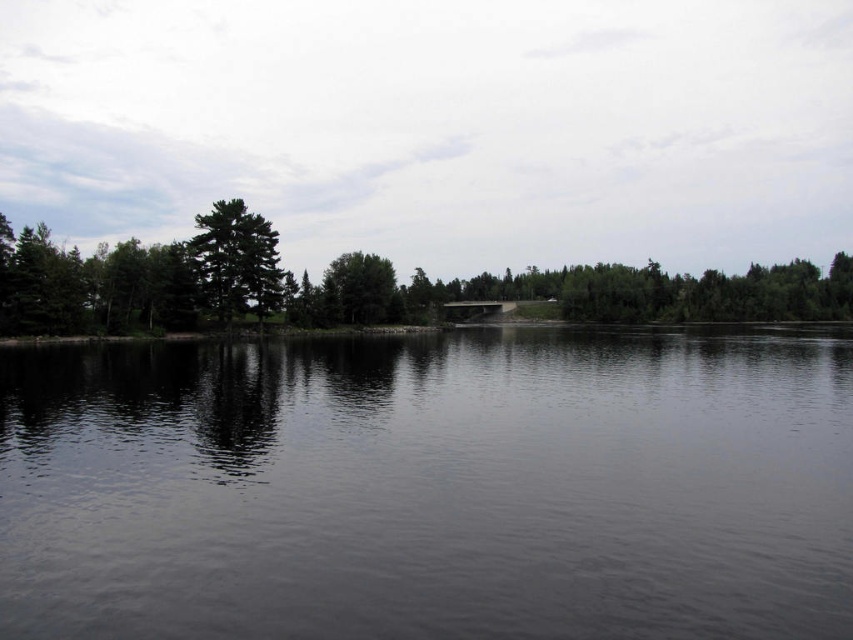
Question: Which of these objects is positioned closest to the green matte tree at center?

Choices:
 (A) dark reflective water at center
 (B) green matte tree at left

Answer: (B)

Question: Can you confirm if green matte tree at center is bigger than green matte tree at left?

Choices:
 (A) yes
 (B) no

Answer: (A)

Question: Which of these objects is positioned closest to the green matte tree at left?

Choices:
 (A) green matte tree at center
 (B) dark reflective water at center

Answer: (A)

Question: Which point appears farthest from the camera in this image?

Choices:
 (A) (200, 612)
 (B) (3, 278)

Answer: (B)

Question: Does green matte tree at center appear under green matte tree at left?

Choices:
 (A) yes
 (B) no

Answer: (B)

Question: From the image, what is the correct spatial relationship of dark reflective water at center in relation to green matte tree at center?

Choices:
 (A) above
 (B) below

Answer: (B)